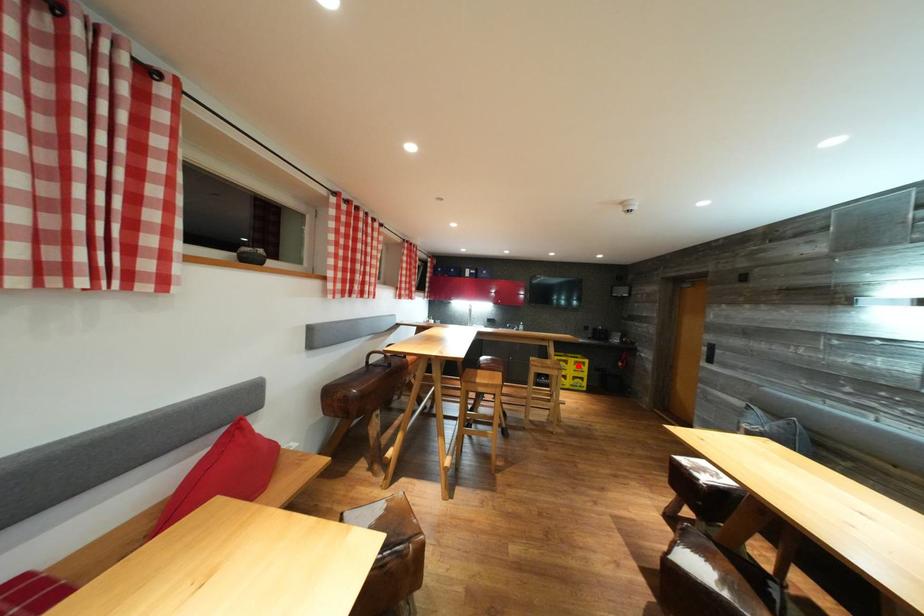
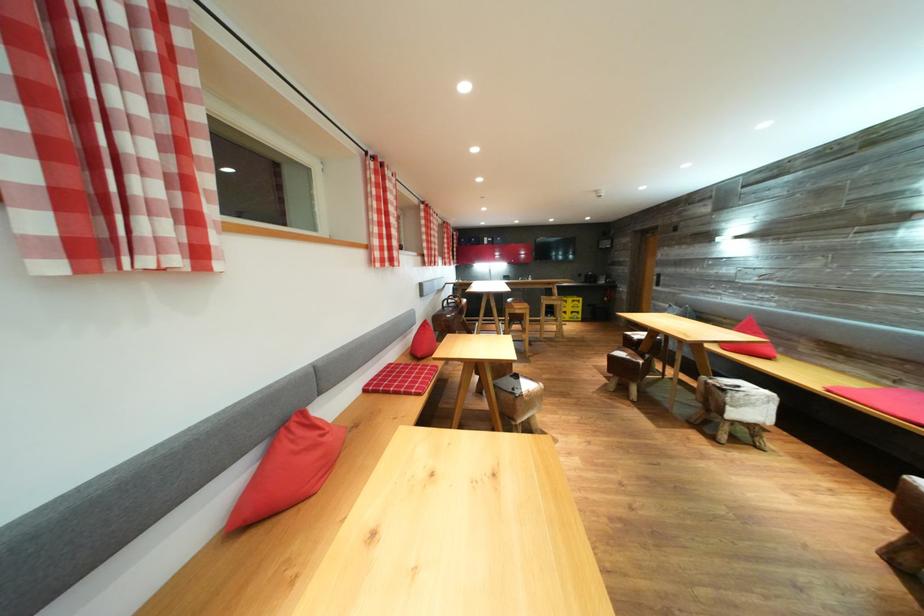
Question: A red point is marked in image1. In image2, is the corresponding 3D point closer to the camera or farther? Reply with the corresponding letter.

Choices:
 (A) The corresponding 3D point is closer.
 (B) The corresponding 3D point is farther.

Answer: (A)